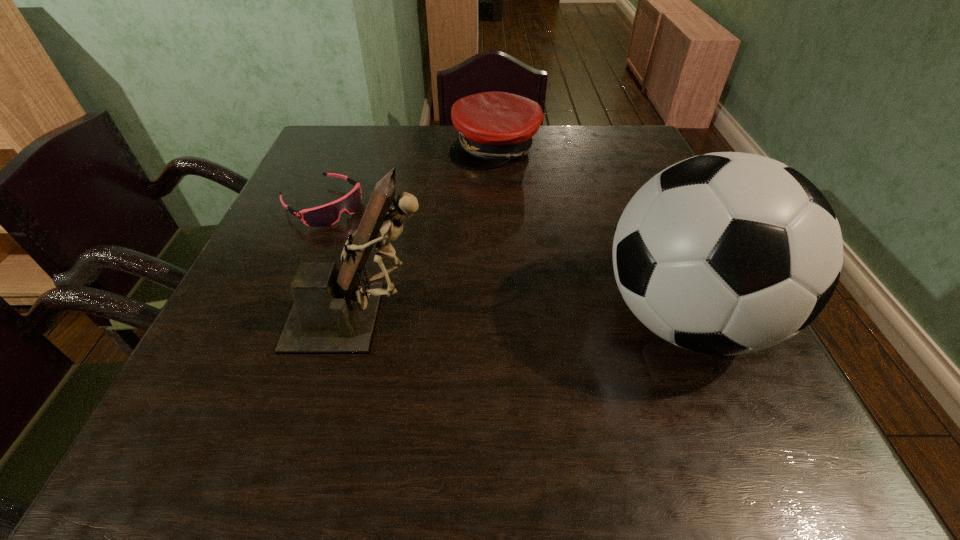
This screenshot has height=540, width=960. What are the coordinates of `vacant region between the figurine and the cap` in the screenshot? It's located at (428, 233).

The width and height of the screenshot is (960, 540). In order to click on vacant region between the soccer ball and the cap in this screenshot , I will do `click(589, 233)`.

You are a GUI agent. You are given a task and a screenshot of the screen. Output one action in this format:
    pyautogui.click(x=<x>, y=<y>)
    Task: Click on the free area in between the soccer ball and the shortest object
    The width and height of the screenshot is (960, 540).
    Given the screenshot: What is the action you would take?
    pyautogui.click(x=503, y=261)

This screenshot has height=540, width=960. Find the location of `free space between the soccer ball and the cap`. free space between the soccer ball and the cap is located at coordinates (589, 233).

This screenshot has height=540, width=960. What are the coordinates of `unoccupied position between the rightmost object and the figurine` in the screenshot? It's located at (523, 318).

Find the location of a particular element. Image resolution: width=960 pixels, height=540 pixels. blank region between the soccer ball and the cap is located at coordinates (589, 233).

At what (x,y) coordinates should I click in order to perform the action: click on empty space that is in between the figurine and the second object from right to left. Please return your answer as a coordinate pair (x, y). This screenshot has height=540, width=960. Looking at the image, I should click on (428, 233).

At what (x,y) coordinates should I click in order to perform the action: click on free point between the rightmost object and the third nearest object. Please return your answer as a coordinate pair (x, y). The width and height of the screenshot is (960, 540). Looking at the image, I should click on (503, 261).

Locate an element on the screen. This screenshot has width=960, height=540. object that can be found as the second closest to the rightmost object is located at coordinates (494, 128).

Locate an element on the screen. This screenshot has width=960, height=540. the third closest object relative to the figurine is located at coordinates (494, 128).